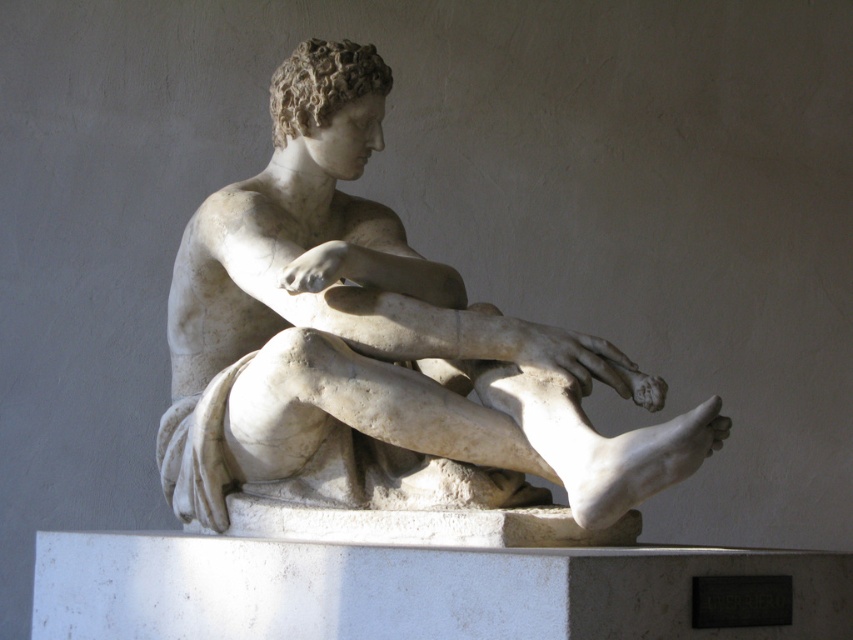
Looking at this image, you are an art conservator assessing the structural integrity of the white marble statue at center and the white marble pillar at center. Which object has a smaller cross sectional area?

The white marble statue at center is thinner than the white marble pillar at center, so the statue has a smaller cross sectional area.

You are an art conservator standing at the entrance of the gallery. You need to move the white marble statue at center to the storage room located behind the white marble pillar at center. The gallery has a 5 meter clearance height. Can you lift the statue vertically without hitting the ceiling?

The white marble statue at center is 4.67 meters away from the white marble pillar at center. Since the statue is being moved vertically, its height must be less than the 5 meter clearance. However, the statue itself is likely taller than 4.67 meters if it is a large sculpture. Without knowing the statue height, we cannot confirm if it fits. The distance between objects does not indicate statue height.

You are an art conservator examining the sculpture. You notice two points of erosion on the sculpture. One is at point (494, 481) and the other at point (454, 634). Which of these two points is closer to the surface you are currently observing?

Point (494, 481) is further to the camera than point (454, 634), so the point closer to your observation surface is point (454, 634).